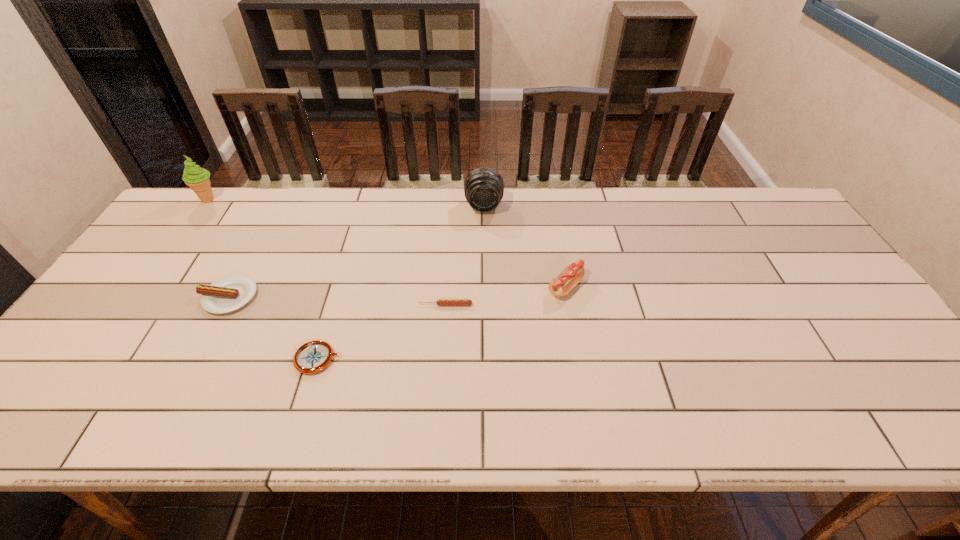
Identify the location of the leftmost object. This screenshot has height=540, width=960. (197, 178).

Where is `the tallest object`? the tallest object is located at coordinates [x=197, y=178].

This screenshot has width=960, height=540. I want to click on telephoto lens, so click(483, 188).

Where is `the tallest sausage`? The width and height of the screenshot is (960, 540). the tallest sausage is located at coordinates (561, 285).

You are a GUI agent. You are given a task and a screenshot of the screen. Output one action in this format:
    pyautogui.click(x=<x>, y=<y>)
    Task: Click on the rightmost sausage
    
    Given the screenshot: What is the action you would take?
    pyautogui.click(x=561, y=285)

Locate an element on the screen. The image size is (960, 540). the second tallest sausage is located at coordinates (229, 293).

You are a GUI agent. You are given a task and a screenshot of the screen. Output one action in this format:
    pyautogui.click(x=<x>, y=<y>)
    Task: Click on the leftmost sausage
    
    Given the screenshot: What is the action you would take?
    pyautogui.click(x=229, y=293)

Find the location of `the third object from left to right`. the third object from left to right is located at coordinates (312, 357).

Locate an element on the screen. The image size is (960, 540). the nearest object is located at coordinates (312, 357).

The image size is (960, 540). I want to click on the shortest sausage, so (x=440, y=302).